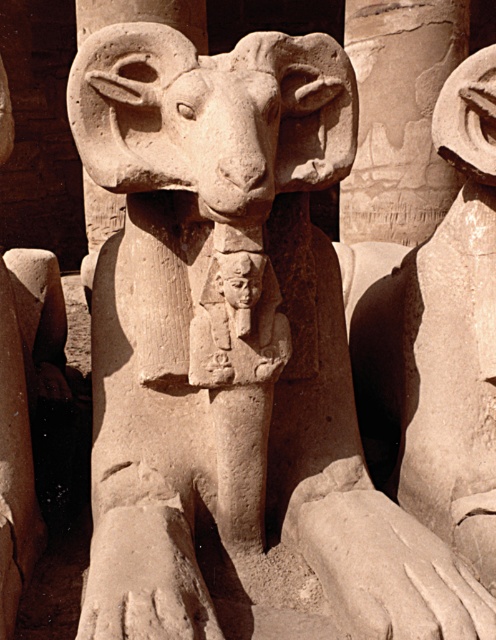
You are an archaeologist examining the ancient Egyptian statue. You notice two objects on the statue. One is a smooth stone column at center and the other is a smooth stone ram at center. From your perspective, which object is positioned to the right?

The smooth stone column at center is to the right of the smooth stone ram at center, so the smooth stone column at center is positioned to the right.

In the scene shown: What are the coordinates of the smooth stone column at center in the image?

The smooth stone column at center is located at coordinates point (x=399, y=116).

You are an archaeologist examining the ancient Egyptian statue. You notice a point marked at coordinates [399,116]. What object is located at this point?

The smooth stone column at center is located at point [399,116].